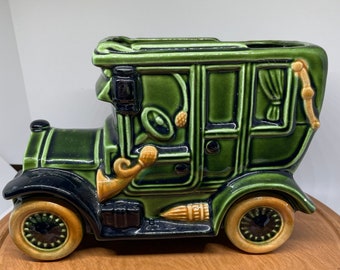
The height and width of the screenshot is (270, 340). In order to click on wall in this screenshot , I will do `click(74, 51)`, `click(13, 89)`.